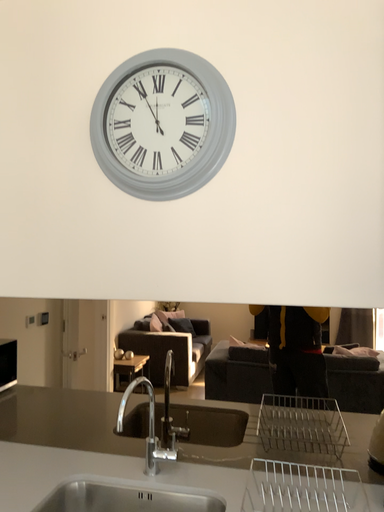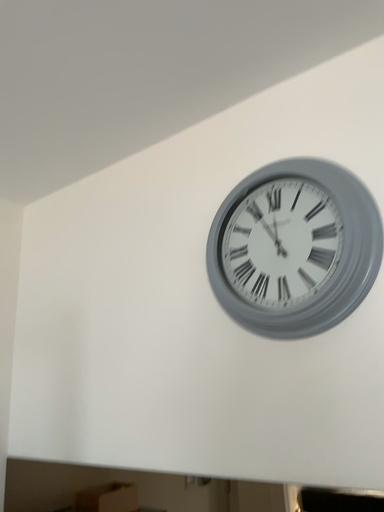
Question: Which way did the camera rotate in the video?

Choices:
 (A) rotated left
 (B) rotated right

Answer: (A)